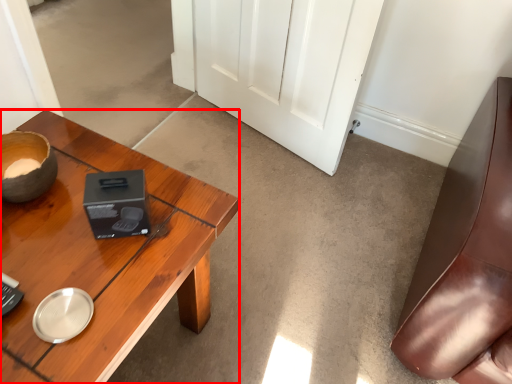
Question: Observing the image, what is the correct spatial positioning of desk (annotated by the red box) in reference to door?

Choices:
 (A) left
 (B) right

Answer: (A)